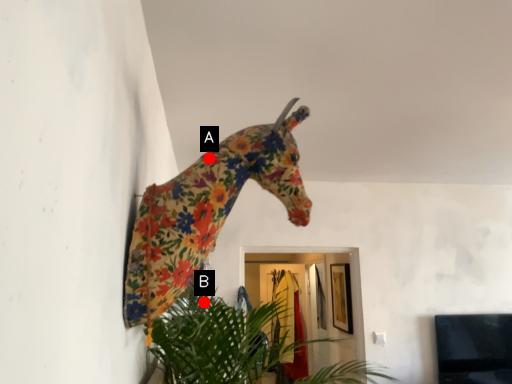
Question: Two points are circled on the image, labeled by A and B beside each circle. Which of the following is the farthest from the observer?

Choices:
 (A) A is further
 (B) B is further

Answer: (B)